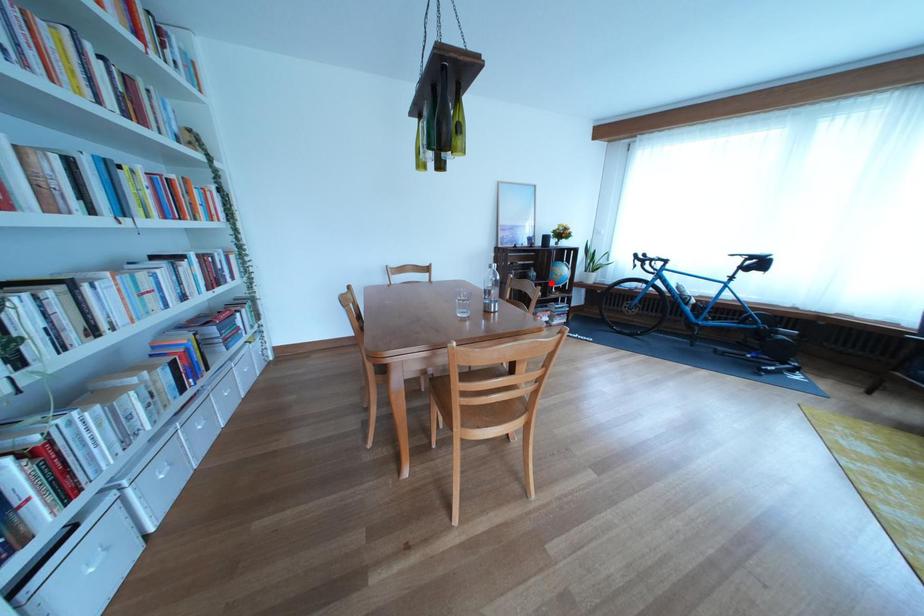
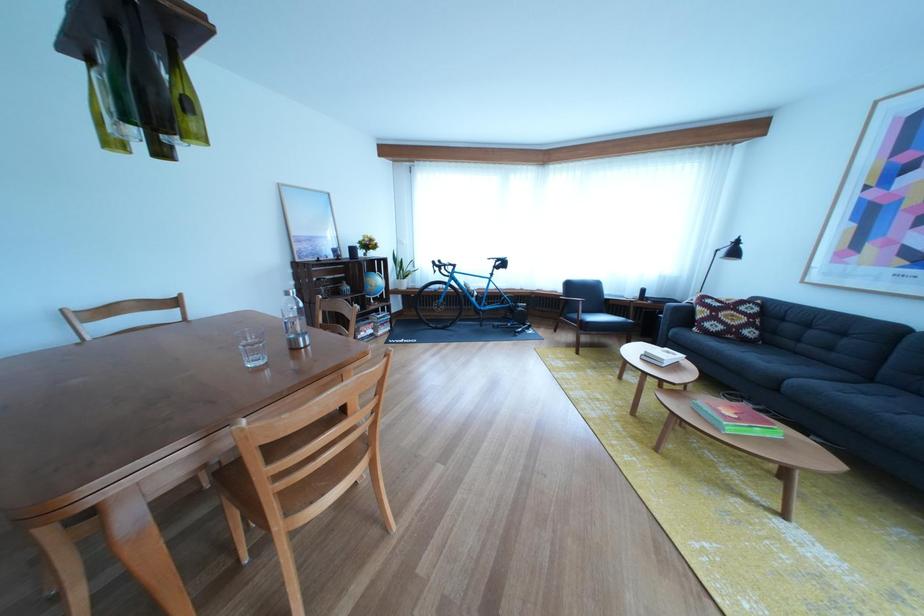
Question: I am providing you with two images of the same scene from different viewpoints. Image1 has a red point marked. In image2, the corresponding 3D location appears at what relative position? Reply with the corresponding letter.

Choices:
 (A) Closer
 (B) Farther

Answer: (A)